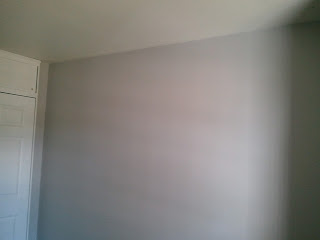
The width and height of the screenshot is (320, 240). What are the coordinates of `corner ov celing and wall` in the screenshot? It's located at (129, 51).